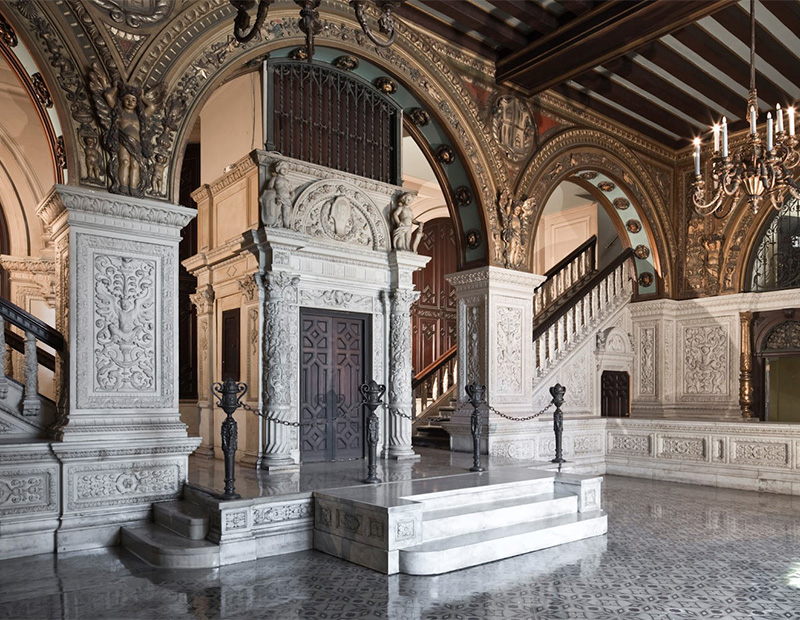
At what (x,y) coordinates should I click in order to perform the action: click on stair rail. Please return your answer as a coordinate pair (x, y). The image size is (800, 620). Looking at the image, I should click on (430, 366), (562, 308), (18, 312), (14, 342).